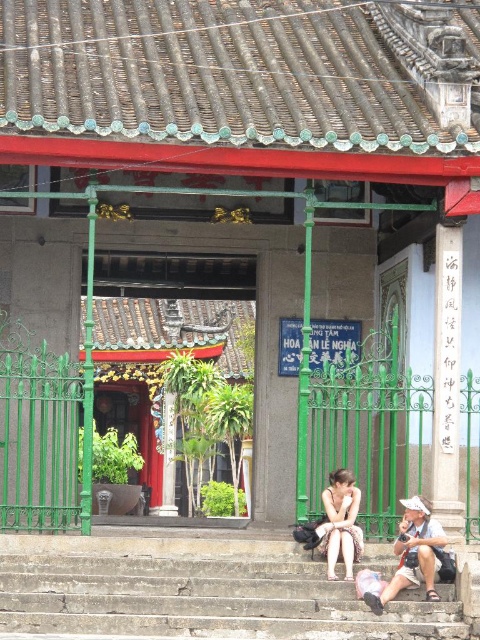
Question: Is concrete stairs at lower center positioned before matte white dress at center?

Choices:
 (A) yes
 (B) no

Answer: (A)

Question: Does concrete stairs at lower center appear on the right side of white cotton dress at center?

Choices:
 (A) no
 (B) yes

Answer: (A)

Question: Estimate the real-world distances between objects in this image. Which object is farther from the concrete stairs at lower center?

Choices:
 (A) matte white dress at center
 (B) white cotton dress at center
 (C) matte white shirt at lower center

Answer: (C)

Question: Which object is closer to the camera taking this photo?

Choices:
 (A) matte white shirt at lower center
 (B) white cotton dress at center
 (C) concrete stairs at lower center
 (D) matte white dress at center

Answer: (C)

Question: Considering the real-world distances, which object is closest to the matte white shirt at lower center?

Choices:
 (A) concrete stairs at lower center
 (B) white cotton dress at center

Answer: (B)

Question: Can you confirm if concrete stairs at lower center is positioned to the right of matte white dress at center?

Choices:
 (A) yes
 (B) no

Answer: (B)